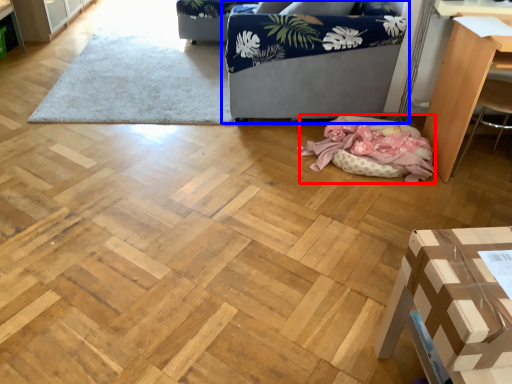
Question: Which point is closer to the camera, blanket (highlighted by a red box) or studio couch (highlighted by a blue box)?

Choices:
 (A) blanket
 (B) studio couch

Answer: (A)